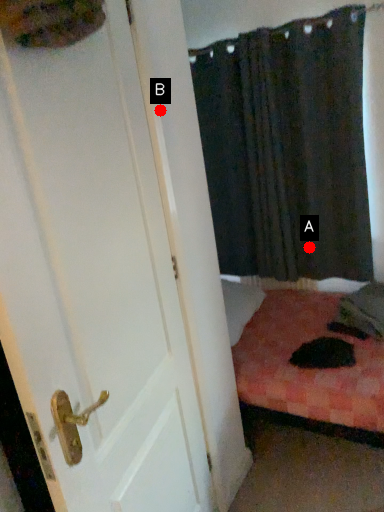
Question: Two points are circled on the image, labeled by A and B beside each circle. Which point is closer to the camera?

Choices:
 (A) A is closer
 (B) B is closer

Answer: (B)